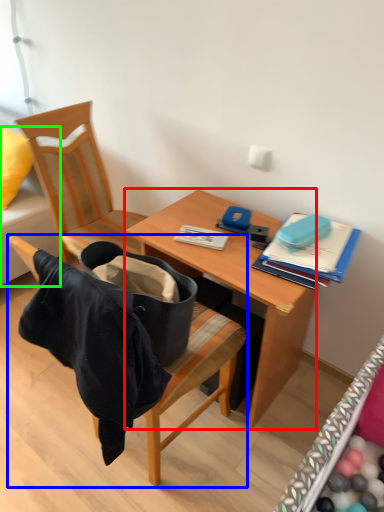
Question: Which object is positioned farthest from desk (highlighted by a red box)? Select from chair (highlighted by a blue box) and studio couch (highlighted by a green box).

Choices:
 (A) chair
 (B) studio couch

Answer: (B)